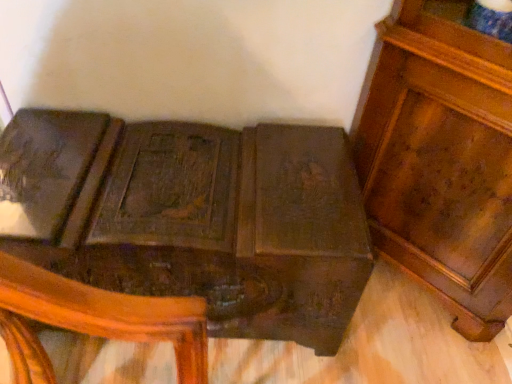
Locate an element on the screen. empty space that is ontop of dark wood carved trunk at center, which is the first furniture from left to right (from a real-world perspective) is located at coordinates (178, 178).